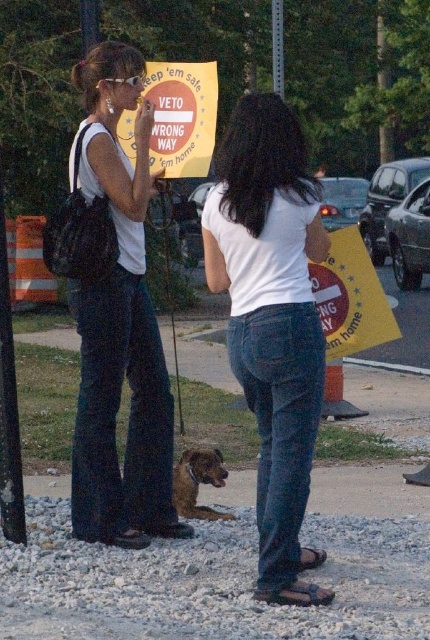
Question: Which is nearer to the yellow paper sign at right?

Choices:
 (A) matte white tank top at center
 (B) brushed metal pole at upper center

Answer: (A)

Question: Does matte white tank top at center have a greater width compared to brushed metal pole at upper center?

Choices:
 (A) yes
 (B) no

Answer: (A)

Question: In this image, where is matte white tank top at center located relative to yellow paper sign at center?

Choices:
 (A) right
 (B) left

Answer: (B)

Question: Where is yellow paper sign at right located in relation to brushed metal pole at upper center in the image?

Choices:
 (A) left
 (B) right

Answer: (B)

Question: Which point appears farthest from the camera in this image?

Choices:
 (A) (275, 88)
 (B) (196, 115)

Answer: (A)

Question: Considering the real-world distances, which object is closest to the brushed metal pole at upper center?

Choices:
 (A) yellow paper sign at right
 (B) white matte shirt at center

Answer: (A)